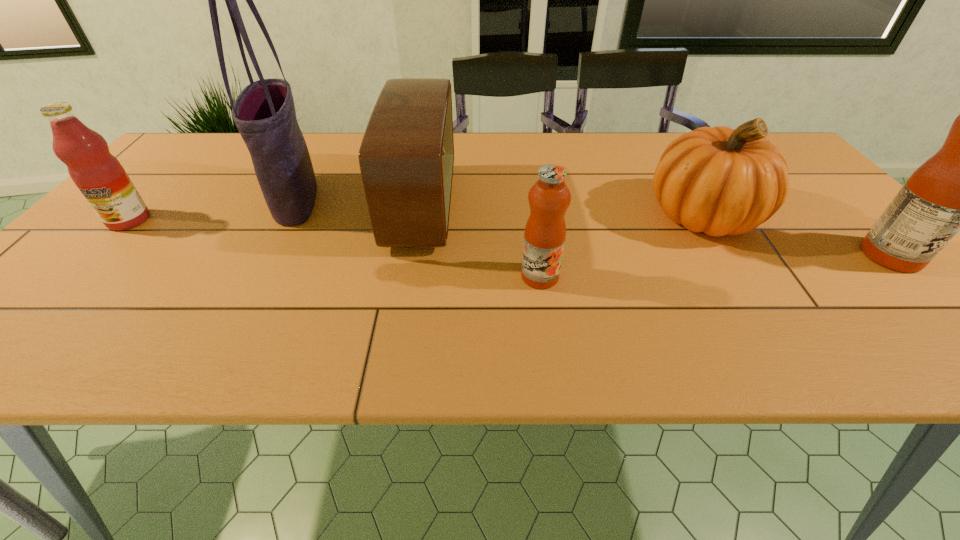
What are the coordinates of `free area in between the radio receiver and the second fruit juice from left to right` in the screenshot? It's located at (481, 242).

The height and width of the screenshot is (540, 960). Identify the location of object that ranks as the closest to the rightmost object. (721, 181).

Point out which object is positioned as the third nearest to the leftmost object. Please provide its 2D coordinates. Your answer should be formatted as a tuple, i.e. [(x, y)], where the tuple contains the x and y coordinates of a point satisfying the conditions above.

[(549, 197)]

Identify the location of fruit juice that is the second closest to the farthest fruit juice. This screenshot has height=540, width=960. (959, 188).

Locate an element on the screen. The width and height of the screenshot is (960, 540). fruit juice that is the second closest to the pumpkin is located at coordinates (549, 197).

This screenshot has width=960, height=540. Find the location of `vacant space that satisfies the following two spatial constraints: 1. on the back side of the pumpkin; 2. on the front-facing side of the radio receiver`. vacant space that satisfies the following two spatial constraints: 1. on the back side of the pumpkin; 2. on the front-facing side of the radio receiver is located at coordinates (699, 207).

Locate an element on the screen. free space that satisfies the following two spatial constraints: 1. on the front-facing side of the third object from left to right; 2. on the label of the leftmost object is located at coordinates (420, 220).

The width and height of the screenshot is (960, 540). Find the location of `vacant region that satisfies the following two spatial constraints: 1. on the front label of the rightmost fruit juice; 2. on the front label of the third object from right to left`. vacant region that satisfies the following two spatial constraints: 1. on the front label of the rightmost fruit juice; 2. on the front label of the third object from right to left is located at coordinates (912, 276).

The height and width of the screenshot is (540, 960). I want to click on vacant space that satisfies the following two spatial constraints: 1. on the back side of the pumpkin; 2. on the front-facing side of the radio receiver, so click(x=699, y=207).